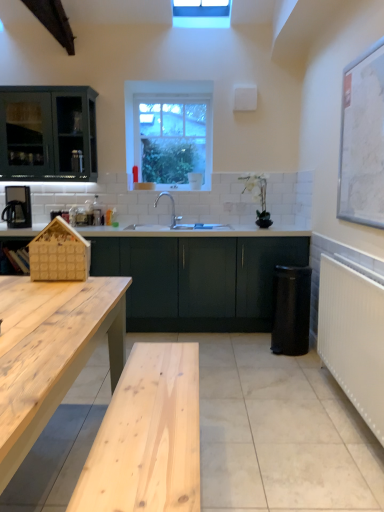
Question: Is matte black kettle at left to the left or to the right of natural wood table at left in the image?

Choices:
 (A) right
 (B) left

Answer: (B)

Question: From a real-world perspective, is matte black kettle at left above or below natural wood table at left?

Choices:
 (A) below
 (B) above

Answer: (B)

Question: Which is farther from the matte black kettle at left?

Choices:
 (A) white textured radiator at right
 (B) white matte map at upper right
 (C) wooden house at left
 (D) natural wood table at left
 (E) white ceramic sink at center

Answer: (A)

Question: Estimate the real-world distances between objects in this image. Which object is farther from the clear glass window at upper center?

Choices:
 (A) white matte map at upper right
 (B) white ceramic sink at center
 (C) natural wood table at left
 (D) matte green cabinet at center
 (E) wooden house at left

Answer: (C)